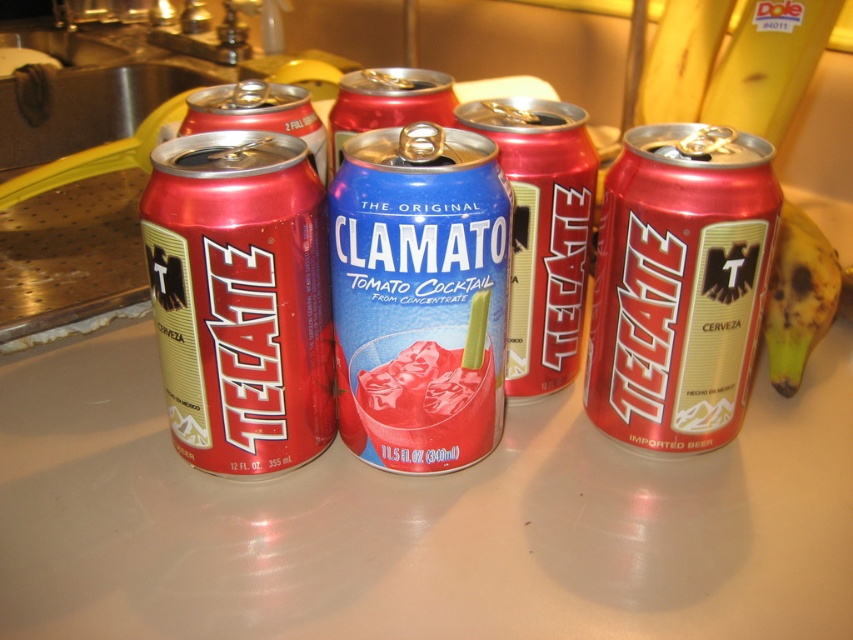
Between matte red can at left and yellow/golden skin at right, which one has more height?

matte red can at left

Which is more to the left, matte red can at left or yellow/golden skin at right?

matte red can at left

Where is `matte red can at left`? matte red can at left is located at coordinates (241, 298).

Identify the location of matte red can at left. (241, 298).

Image resolution: width=853 pixels, height=640 pixels. I want to click on matte red can at left, so click(241, 298).

Can you confirm if matte red can at center is thinner than yellow/golden skin at right?

Indeed, matte red can at center has a lesser width compared to yellow/golden skin at right.

Who is higher up, matte red can at center or yellow/golden skin at right?

Positioned higher is matte red can at center.

Does point (677, 349) come closer to viewer compared to point (781, 275)?

Yes, point (677, 349) is in front of point (781, 275).

Where is `matte red can at center`? matte red can at center is located at coordinates (679, 284).